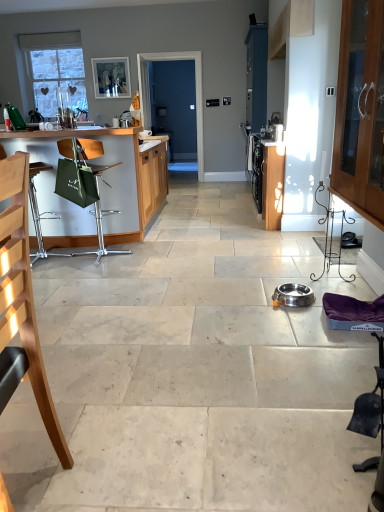
Question: Is stainless steel bowl at center oriented towards blue glossy screen door at center?

Choices:
 (A) yes
 (B) no

Answer: (B)

Question: Is stainless steel bowl at center touching blue glossy screen door at center?

Choices:
 (A) no
 (B) yes

Answer: (A)

Question: Is stainless steel bowl at center behind blue glossy screen door at center?

Choices:
 (A) no
 (B) yes

Answer: (A)

Question: Does stainless steel bowl at center have a larger size compared to blue glossy screen door at center?

Choices:
 (A) no
 (B) yes

Answer: (A)

Question: Considering the relative positions of stainless steel bowl at center and blue glossy screen door at center in the image provided, is stainless steel bowl at center to the right of blue glossy screen door at center from the viewer's perspective?

Choices:
 (A) no
 (B) yes

Answer: (B)

Question: From a real-world perspective, is matte white picture frame at upper center above or below green fabric bag at left?

Choices:
 (A) above
 (B) below

Answer: (A)

Question: Is matte white picture frame at upper center to the left or to the right of green fabric bag at left in the image?

Choices:
 (A) left
 (B) right

Answer: (A)

Question: In terms of height, does matte white picture frame at upper center look taller or shorter compared to green fabric bag at left?

Choices:
 (A) tall
 (B) short

Answer: (B)

Question: Considering the positions of point (130, 95) and point (34, 253), is point (130, 95) closer or farther from the camera than point (34, 253)?

Choices:
 (A) farther
 (B) closer

Answer: (A)

Question: From their relative heights in the image, would you say blue glossy screen door at center is taller or shorter than metallic silver bowl at center?

Choices:
 (A) tall
 (B) short

Answer: (A)

Question: Is blue glossy screen door at center in front of or behind metallic silver bowl at center in the image?

Choices:
 (A) front
 (B) behind

Answer: (B)

Question: Is point [178, 131] positioned closer to the camera than point [238, 376]?

Choices:
 (A) farther
 (B) closer

Answer: (A)

Question: Which is correct: blue glossy screen door at center is inside metallic silver bowl at center, or outside of it?

Choices:
 (A) outside
 (B) inside

Answer: (A)

Question: Is point (97, 146) closer or farther from the camera than point (339, 40)?

Choices:
 (A) farther
 (B) closer

Answer: (B)

Question: Is green fabric chair at left, placed as the first chair when sorted from back to front, bigger or smaller than wooden cabinet with glass doors at right?

Choices:
 (A) big
 (B) small

Answer: (B)